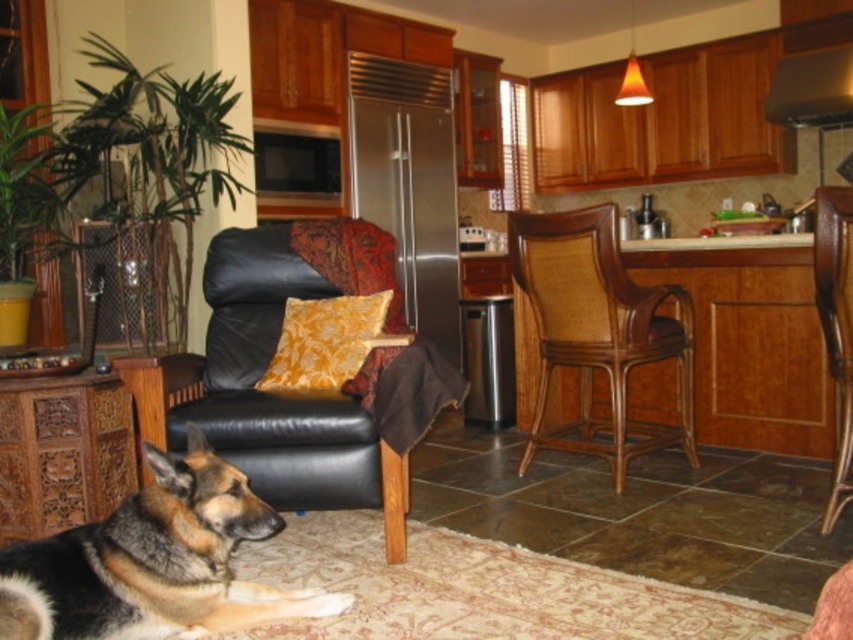
Question: Is brown fur dog at lower left positioned in front of brown wood chair at center?

Choices:
 (A) yes
 (B) no

Answer: (A)

Question: Is brown woven wood chair at center further to the viewer compared to stainless steel exhaust hood at upper right?

Choices:
 (A) yes
 (B) no

Answer: (B)

Question: Which object is the farthest from the brown woven wood chair at center?

Choices:
 (A) stainless steel exhaust hood at upper right
 (B) yellow floral pillow at center

Answer: (A)

Question: Which is nearer to the brown woven wood chair at center?

Choices:
 (A) yellow floral pillow at center
 (B) brown fur dog at lower left
 (C) stainless steel exhaust hood at upper right
 (D) brown wood chair at center

Answer: (D)

Question: From the image, what is the correct spatial relationship of brown fur dog at lower left in relation to brown wood chair at center?

Choices:
 (A) right
 (B) left

Answer: (B)

Question: Which is nearer to the stainless steel exhaust hood at upper right?

Choices:
 (A) yellow floral pillow at center
 (B) brown fur dog at lower left
 (C) brown wood chair at center

Answer: (C)